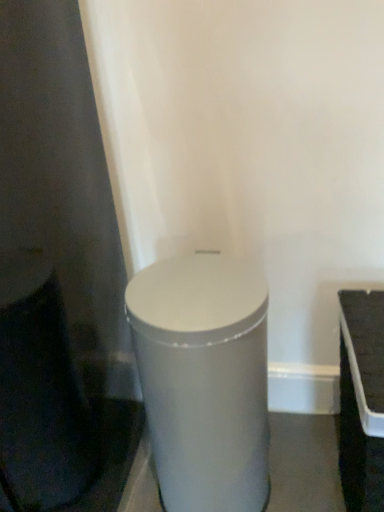
Question: Is white plastic tray at right in front of or behind satin silver cylinder at center in the image?

Choices:
 (A) front
 (B) behind

Answer: (A)

Question: Would you say white plastic tray at right is inside or outside satin silver cylinder at center?

Choices:
 (A) inside
 (B) outside

Answer: (B)

Question: Is white plastic tray at right to the left or to the right of satin silver cylinder at center in the image?

Choices:
 (A) left
 (B) right

Answer: (B)

Question: In the image, is satin silver cylinder at center positioned in front of or behind white plastic tray at right?

Choices:
 (A) behind
 (B) front

Answer: (A)

Question: In terms of height, does satin silver cylinder at center look taller or shorter compared to white plastic tray at right?

Choices:
 (A) short
 (B) tall

Answer: (B)

Question: Is satin silver cylinder at center inside the boundaries of white plastic tray at right, or outside?

Choices:
 (A) outside
 (B) inside

Answer: (A)

Question: Is satin silver cylinder at center bigger or smaller than white plastic tray at right?

Choices:
 (A) big
 (B) small

Answer: (A)